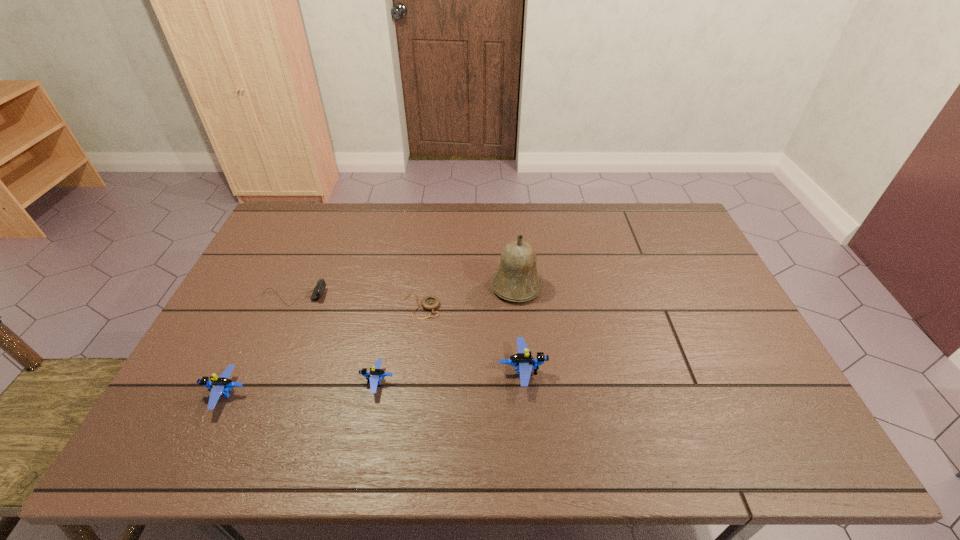
I want to click on free point that keeps the Legos evenly spaced on the right, so click(660, 360).